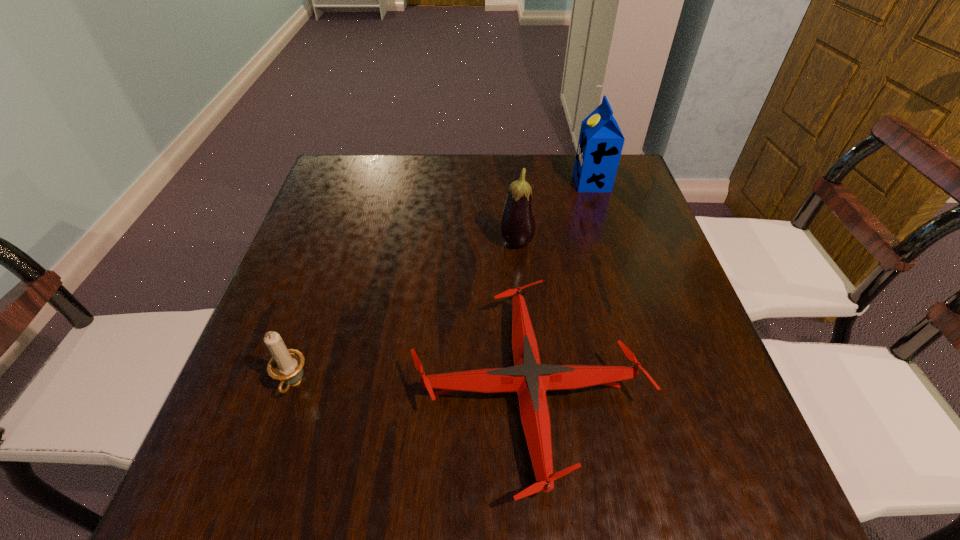
I want to click on free point between the second farthest object and the leftmost object, so click(405, 314).

Find the location of a particular element. This screenshot has width=960, height=540. unoccupied area between the candle_holder and the carton is located at coordinates (443, 284).

Locate an element on the screen. The width and height of the screenshot is (960, 540). vacant area that lies between the leftmost object and the shortest object is located at coordinates tap(411, 388).

This screenshot has width=960, height=540. I want to click on free space between the third nearest object and the leftmost object, so click(405, 314).

Locate which object ranks in proximity to the drone. Please provide its 2D coordinates. Your answer should be formatted as a tuple, i.e. [(x, y)], where the tuple contains the x and y coordinates of a point satisfying the conditions above.

[(517, 225)]

Identify the location of object that is the closest to the farthest object. This screenshot has width=960, height=540. (517, 225).

Find the location of `free spot that satisfies the following two spatial constraints: 1. on the back side of the drone; 2. on the left side of the eggplant`. free spot that satisfies the following two spatial constraints: 1. on the back side of the drone; 2. on the left side of the eggplant is located at coordinates (516, 244).

You are a GUI agent. You are given a task and a screenshot of the screen. Output one action in this format:
    pyautogui.click(x=<x>, y=<y>)
    Task: Click on the vacant point that satisfies the following two spatial constraints: 1. with the cap open on the farthest object; 2. on the front side of the shortest object
    The image size is (960, 540).
    Given the screenshot: What is the action you would take?
    tap(656, 390)

This screenshot has height=540, width=960. Identify the location of free location that satisfies the following two spatial constraints: 1. with the cap open on the carton; 2. on the front side of the drone. (656, 390).

Image resolution: width=960 pixels, height=540 pixels. Find the location of `vacant area in the image that satisfies the following two spatial constraints: 1. on the handle side of the leftmost object; 2. on the right side of the drone`. vacant area in the image that satisfies the following two spatial constraints: 1. on the handle side of the leftmost object; 2. on the right side of the drone is located at coordinates (292, 390).